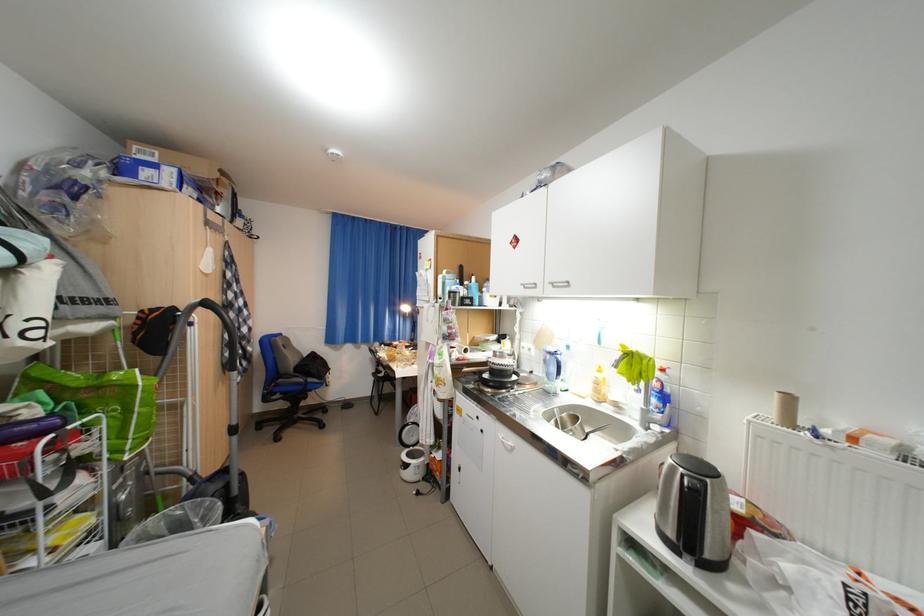
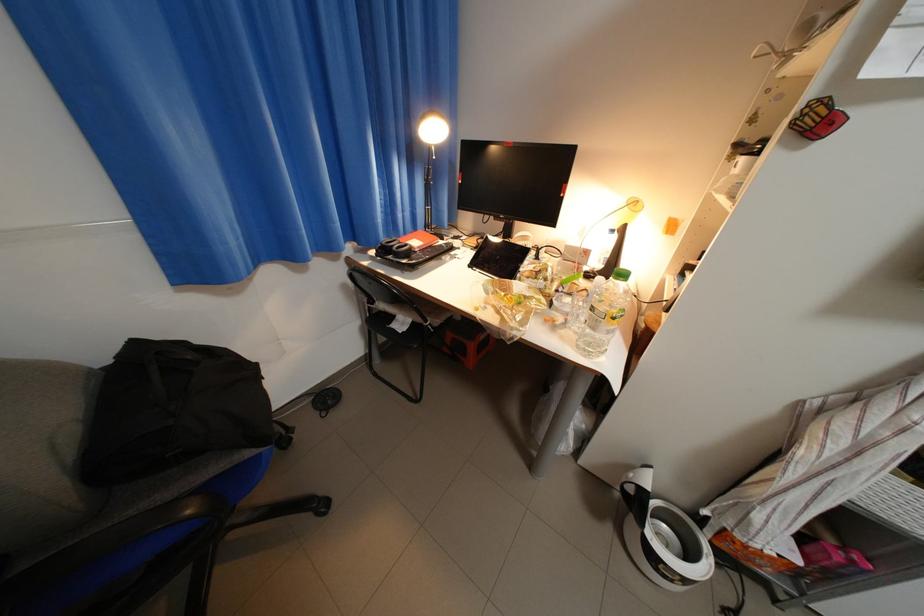
The point at (x=383, y=359) is marked in the first image. Where is the corresponding point in the second image?

(355, 286)